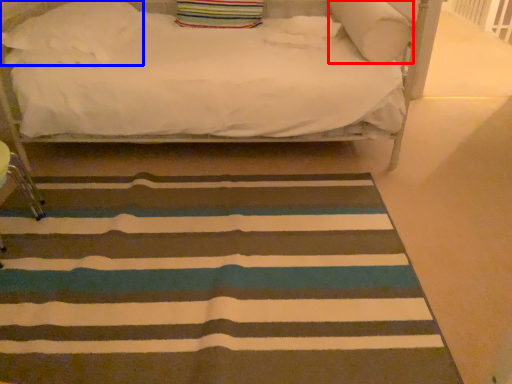
Question: Which point is further to the camera, pillow (highlighted by a red box) or pillow (highlighted by a blue box)?

Choices:
 (A) pillow
 (B) pillow

Answer: (B)